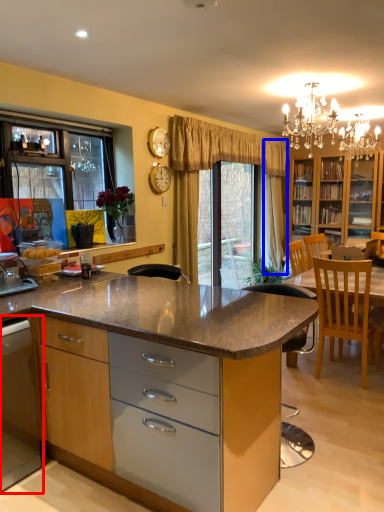
Question: Among these objects, which one is farthest to the camera, cabinetry (highlighted by a red box) or curtain (highlighted by a blue box)?

Choices:
 (A) cabinetry
 (B) curtain

Answer: (B)